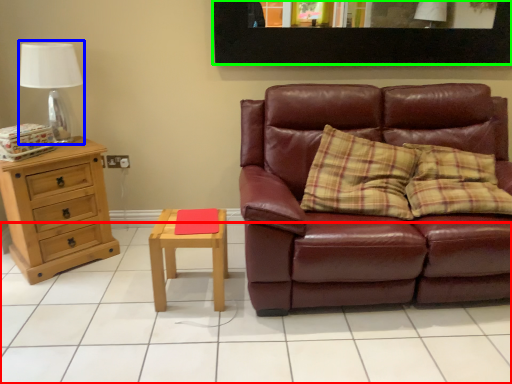
Question: Which is farther away from tile (highlighted by a red box)? table lamp (highlighted by a blue box) or picture frame (highlighted by a green box)?

Choices:
 (A) table lamp
 (B) picture frame

Answer: (B)